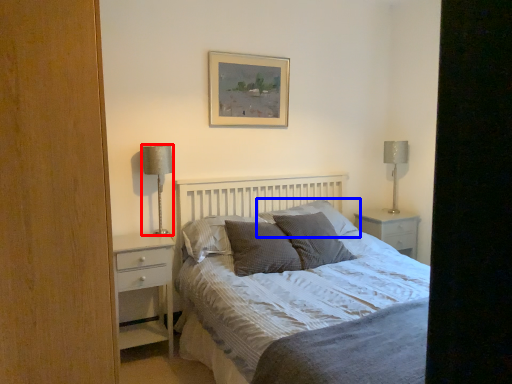
Question: Which of the following is the closest to the observer, table lamp (highlighted by a red box) or pillow (highlighted by a blue box)?

Choices:
 (A) table lamp
 (B) pillow

Answer: (A)